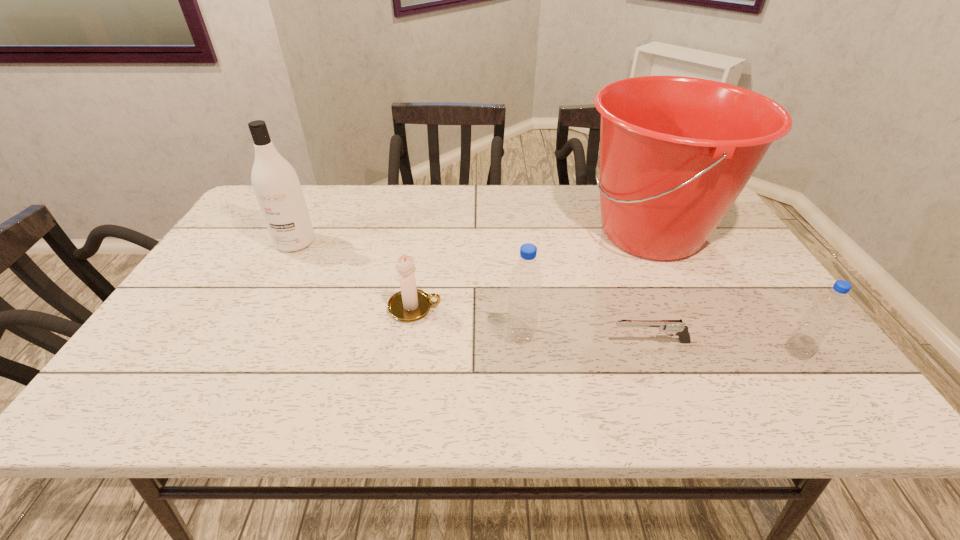
At what (x,y) coordinates should I click in order to perform the action: click on vacant space located 0.340m on the left of the right water bottle. Please return your answer as a coordinate pair (x, y). Looking at the image, I should click on (629, 352).

Where is `vacant area situated with the handle attached to the rim of the bucket`? Image resolution: width=960 pixels, height=540 pixels. vacant area situated with the handle attached to the rim of the bucket is located at coordinates (445, 233).

Find the location of `blank area located 0.080m with the handle attached to the rim of the bucket`. blank area located 0.080m with the handle attached to the rim of the bucket is located at coordinates (547, 233).

Find the location of a particular element. Image resolution: width=960 pixels, height=540 pixels. free space located with the handle attached to the rim of the bucket is located at coordinates (524, 233).

Locate an element on the screen. The width and height of the screenshot is (960, 540). vacant space located 0.290m on the front-facing side of the shampoo is located at coordinates (248, 333).

Locate an element on the screen. free spot located on the handle side of the second shortest object is located at coordinates (570, 308).

Where is `vacant space situated on the front-facing side of the pistol`? vacant space situated on the front-facing side of the pistol is located at coordinates (517, 342).

Find the location of `blank space located 0.340m on the front-facing side of the pistol`. blank space located 0.340m on the front-facing side of the pistol is located at coordinates (459, 342).

Where is `vacant space located 0.090m on the front-facing side of the pistol`? Image resolution: width=960 pixels, height=540 pixels. vacant space located 0.090m on the front-facing side of the pistol is located at coordinates (571, 342).

Identify the location of object that is positioned at the far edge. (676, 152).